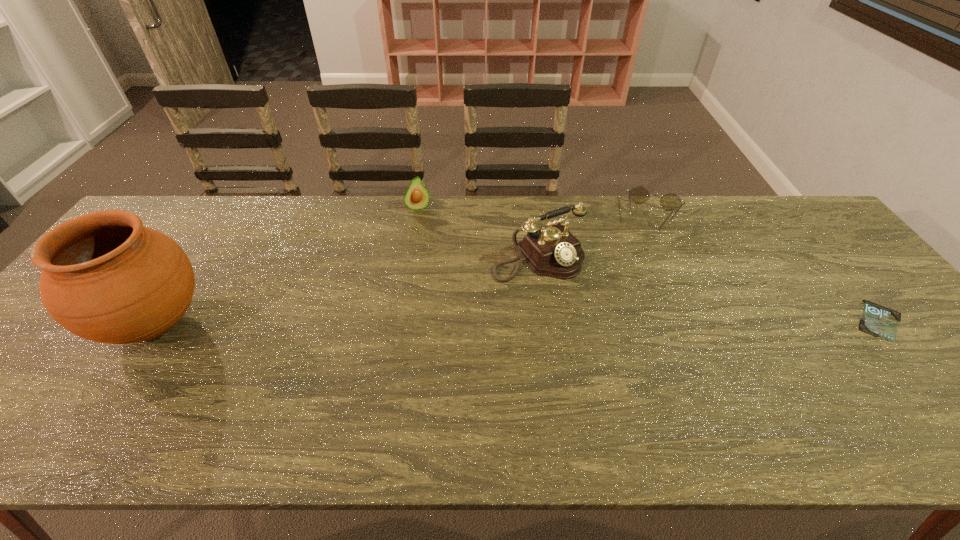
I want to click on vacant space at the far right corner of the desktop, so click(x=776, y=218).

Image resolution: width=960 pixels, height=540 pixels. Find the location of `vacant point located between the avocado and the pottery`. vacant point located between the avocado and the pottery is located at coordinates (287, 266).

Locate an element on the screen. vacant region between the telephone and the shortest object is located at coordinates (708, 288).

Identify the location of free space between the identity card and the pottery. The height and width of the screenshot is (540, 960). (516, 322).

Find the location of a particular element. This screenshot has width=960, height=540. free space between the third tallest object and the second object from right to left is located at coordinates (536, 212).

Image resolution: width=960 pixels, height=540 pixels. What are the coordinates of `vacant space that's between the shortest object and the second object from left to right` in the screenshot? It's located at (648, 264).

This screenshot has height=540, width=960. Identify the location of free space that is in between the second object from left to right and the spectacles. (536, 212).

Locate an element on the screen. The height and width of the screenshot is (540, 960). vacant area between the fourth object from right to left and the fourth shortest object is located at coordinates (478, 232).

What are the coordinates of `free space between the second tallest object and the pottery` in the screenshot? It's located at (347, 290).

Find the location of a particular element. The height and width of the screenshot is (540, 960). free area in between the third object from right to left and the third shortest object is located at coordinates (478, 232).